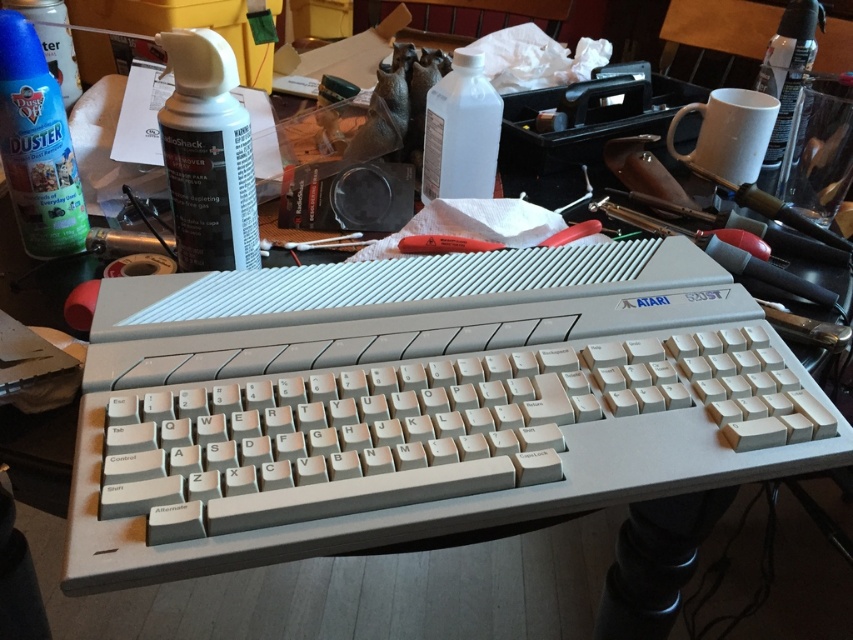
Question: Can you confirm if white matte spray can at upper left is smaller than blue plastic spray can at upper left?

Choices:
 (A) yes
 (B) no

Answer: (A)

Question: Is white matte spray can at upper left to the right of red plastic screwdriver at center from the viewer's perspective?

Choices:
 (A) yes
 (B) no

Answer: (B)

Question: Which object is positioned closest to the transparent plastic bottle at upper center?

Choices:
 (A) red plastic screwdriver at center
 (B) blue plastic duster at upper left
 (C) white matte spray can at upper left

Answer: (A)

Question: Which of these objects is positioned closest to the blue plastic spray can at upper left?

Choices:
 (A) white matte spray can at upper left
 (B) transparent plastic bottle at upper center
 (C) clear plastic spray can at upper right

Answer: (A)

Question: Considering the real-world distances, which object is farthest from the white matte spray can at upper left?

Choices:
 (A) red plastic screwdriver at center
 (B) blue plastic duster at upper left
 (C) clear plastic spray can at upper right
 (D) transparent plastic bottle at upper center

Answer: (C)

Question: Does clear plastic spray can at upper right appear over red plastic screwdriver at center?

Choices:
 (A) yes
 (B) no

Answer: (A)